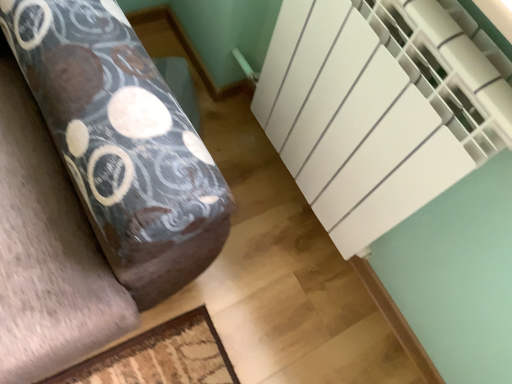
Question: Should I look upward or downward to see white matte radiator at upper right?

Choices:
 (A) down
 (B) up

Answer: (A)

Question: Is white matte radiator at right positioned beyond the bounds of white matte radiator at upper right?

Choices:
 (A) no
 (B) yes

Answer: (B)

Question: From the image's perspective, is white matte radiator at right above white matte radiator at upper right?

Choices:
 (A) no
 (B) yes

Answer: (B)

Question: Is white matte radiator at right beside white matte radiator at upper right?

Choices:
 (A) yes
 (B) no

Answer: (B)

Question: From a real-world perspective, does white matte radiator at right stand above white matte radiator at upper right?

Choices:
 (A) yes
 (B) no

Answer: (A)

Question: Is white matte radiator at right to the right of white matte radiator at upper right from the viewer's perspective?

Choices:
 (A) yes
 (B) no

Answer: (A)

Question: Does white matte radiator at right come in front of white matte radiator at upper right?

Choices:
 (A) no
 (B) yes

Answer: (B)

Question: Considering the relative positions of white matte radiator at upper right and white matte radiator at right in the image provided, is white matte radiator at upper right to the left of white matte radiator at right from the viewer's perspective?

Choices:
 (A) yes
 (B) no

Answer: (A)

Question: Is white matte radiator at upper right aimed at white matte radiator at right?

Choices:
 (A) no
 (B) yes

Answer: (A)

Question: Is the depth of white matte radiator at upper right greater than that of white matte radiator at right?

Choices:
 (A) no
 (B) yes

Answer: (B)

Question: Would you say white matte radiator at upper right contains white matte radiator at right?

Choices:
 (A) yes
 (B) no

Answer: (B)

Question: Is white matte radiator at upper right turned away from white matte radiator at right?

Choices:
 (A) yes
 (B) no

Answer: (B)

Question: Considering the relative sizes of white matte radiator at upper right and white matte radiator at right in the image provided, is white matte radiator at upper right bigger than white matte radiator at right?

Choices:
 (A) yes
 (B) no

Answer: (B)

Question: Would you say white matte radiator at right is inside or outside white matte radiator at upper right?

Choices:
 (A) inside
 (B) outside

Answer: (B)